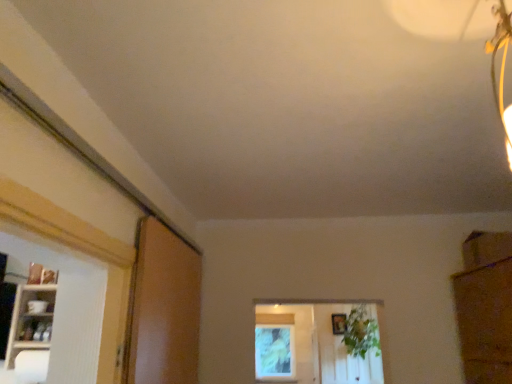
What is the approximate height of white glossy shelf at left?

white glossy shelf at left is 19.61 inches in height.

Locate an element on the screen. The width and height of the screenshot is (512, 384). green leafy plant at center is located at coordinates (361, 333).

Where is `white glossy shelf at left`? The image size is (512, 384). white glossy shelf at left is located at coordinates (30, 320).

Does wooden picture frame at center come behind brown matte screen door at left?

Yes, wooden picture frame at center is behind brown matte screen door at left.

How different are the orientations of wooden picture frame at center and brown matte screen door at left in degrees?

87.3 degrees separate the facing orientations of wooden picture frame at center and brown matte screen door at left.

Could you tell me if wooden picture frame at center is turned towards brown matte screen door at left?

Yes, wooden picture frame at center is facing brown matte screen door at left.

Is green leafy plant at center not near white glossy shelf at left?

Absolutely, green leafy plant at center is distant from white glossy shelf at left.

Between green leafy plant at center and white glossy shelf at left, which one has smaller width?

white glossy shelf at left.

Is green leafy plant at center positioned behind white glossy shelf at left?

Yes, it is.

From a real-world perspective, relative to brown matte screen door at left, is white glossy shelf at left vertically above or below?

white glossy shelf at left is situated lower than brown matte screen door at left in the real world.

At what (x,y) coordinates should I click in order to perform the action: click on screen door lying above the white glossy shelf at left (from the image's perspective). Please return your answer as a coordinate pair (x, y). Looking at the image, I should click on (163, 309).

Which object is more forward, white glossy shelf at left or brown matte screen door at left?

brown matte screen door at left.

Is white glossy shelf at left not near brown matte screen door at left?

No, white glossy shelf at left is in close proximity to brown matte screen door at left.

In order to click on screen door below the wooden picture frame at center (from a real-world perspective) in this screenshot , I will do `click(163, 309)`.

In terms of size, does brown matte screen door at left appear bigger or smaller than wooden picture frame at center?

brown matte screen door at left is bigger than wooden picture frame at center.

Between brown matte screen door at left and wooden picture frame at center, which one has smaller width?

Thinner between the two is wooden picture frame at center.

Is brown matte screen door at left bigger than green leafy plant at center?

No.

Considering the sizes of objects brown matte screen door at left and green leafy plant at center in the image provided, who is wider, brown matte screen door at left or green leafy plant at center?

green leafy plant at center is wider.

Between point (132, 364) and point (372, 338), which one is positioned behind?

The point (372, 338) is farther.

Can you confirm if wooden picture frame at center is positioned to the right of white glossy shelf at left?

Yes.

From a real-world perspective, between wooden picture frame at center and white glossy shelf at left, who is vertically higher?

wooden picture frame at center.

In the scene shown: Which of these two, wooden picture frame at center or white glossy shelf at left, is wider?

Wider between the two is white glossy shelf at left.

Considering the sizes of objects wooden picture frame at center and white glossy shelf at left in the image provided, who is shorter, wooden picture frame at center or white glossy shelf at left?

Answer: With less height is wooden picture frame at center.

Can you confirm if white glossy shelf at left is thinner than green leafy plant at center?

Yes.

From the image's perspective, between white glossy shelf at left and green leafy plant at center, who is located below?

green leafy plant at center, from the image's perspective.

Can green leafy plant at center be found inside white glossy shelf at left?

Actually, green leafy plant at center is outside white glossy shelf at left.

Is white glossy shelf at left facing towards green leafy plant at center?

No, white glossy shelf at left does not turn towards green leafy plant at center.

Identify the location of screen door lying in front of the wooden picture frame at center. (163, 309).

Find the location of `plant on the right of white glossy shelf at left`. plant on the right of white glossy shelf at left is located at coordinates (361, 333).

Looking at the image, which one is located closer to white glossy shelf at left, brown matte screen door at left or wooden picture frame at center?

Among the two, brown matte screen door at left is located nearer to white glossy shelf at left.

Which object lies further to the anchor point wooden picture frame at center, brown matte screen door at left or green leafy plant at center?

brown matte screen door at left is further to wooden picture frame at center.

Estimate the real-world distances between objects in this image. Which object is further from green leafy plant at center, white glossy shelf at left or brown matte screen door at left?

white glossy shelf at left is further to green leafy plant at center.

Looking at the image, which one is located further to white glossy shelf at left, wooden picture frame at center or green leafy plant at center?

Among the two, wooden picture frame at center is located further to white glossy shelf at left.

Which object lies nearer to the anchor point brown matte screen door at left, wooden picture frame at center or green leafy plant at center?

green leafy plant at center is closer to brown matte screen door at left.

Looking at the image, which one is located further to wooden picture frame at center, white glossy shelf at left or green leafy plant at center?

white glossy shelf at left lies further to wooden picture frame at center than the other object.

Considering their positions, is brown matte screen door at left positioned further to wooden picture frame at center than white glossy shelf at left?

white glossy shelf at left is positioned further to the anchor wooden picture frame at center.

Based on the photo, when comparing their distances from wooden picture frame at center, does green leafy plant at center or white glossy shelf at left seem closer?

green leafy plant at center.

Find the location of a particular element. The width and height of the screenshot is (512, 384). shelf between brown matte screen door at left and green leafy plant at center in the front-back direction is located at coordinates (30, 320).

Identify the location of plant between white glossy shelf at left and wooden picture frame at center in the front-back direction. The image size is (512, 384). (361, 333).

Where is `shelf between brown matte screen door at left and wooden picture frame at center from front to back`? shelf between brown matte screen door at left and wooden picture frame at center from front to back is located at coordinates (30, 320).

Where is `plant located between brown matte screen door at left and wooden picture frame at center in the depth direction`? plant located between brown matte screen door at left and wooden picture frame at center in the depth direction is located at coordinates (361, 333).